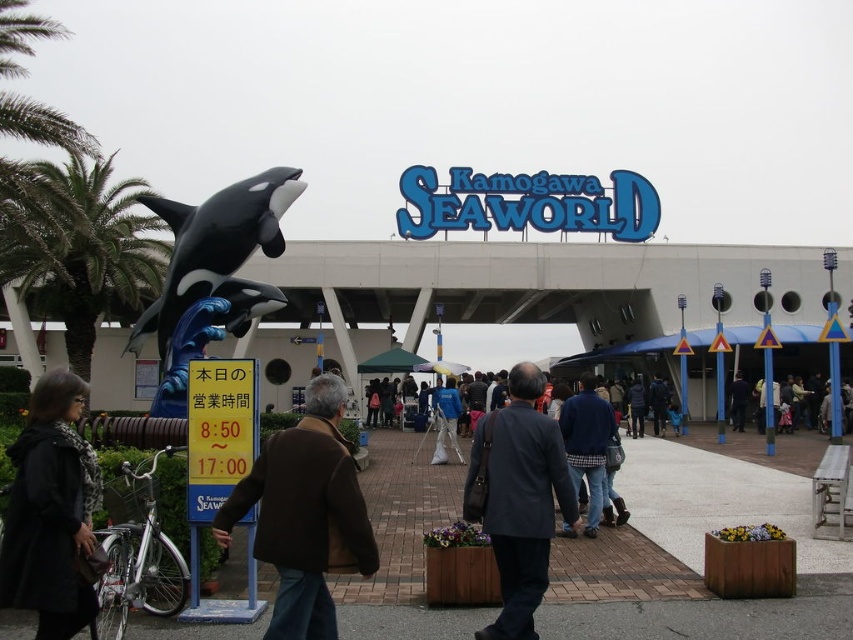
In the scene shown: Is brown leather jacket at center thinner than dark gray suit at center?

→ In fact, brown leather jacket at center might be wider than dark gray suit at center.

How far apart are brown leather jacket at center and dark gray suit at center?

The distance of brown leather jacket at center from dark gray suit at center is 23.33 meters.

The width and height of the screenshot is (853, 640). Describe the element at coordinates (305, 515) in the screenshot. I see `brown leather jacket at center` at that location.

Find the location of `brown leather jacket at center`. brown leather jacket at center is located at coordinates (305, 515).

Measure the distance between point (91,320) and camera.

A distance of 131.47 meters exists between point (91,320) and camera.

Between point (90, 161) and point (793, 420), which one is positioned behind?

Point (793, 420)

This screenshot has height=640, width=853. Identify the location of green leafy palm tree at left. (85, 250).

Which is more to the left, brown leather jacket at center or black glossy orca at left?

Positioned to the left is black glossy orca at left.

Describe the element at coordinates (305, 515) in the screenshot. I see `brown leather jacket at center` at that location.

The image size is (853, 640). Describe the element at coordinates (305, 515) in the screenshot. I see `brown leather jacket at center` at that location.

The image size is (853, 640). Identify the location of brown leather jacket at center. (305, 515).